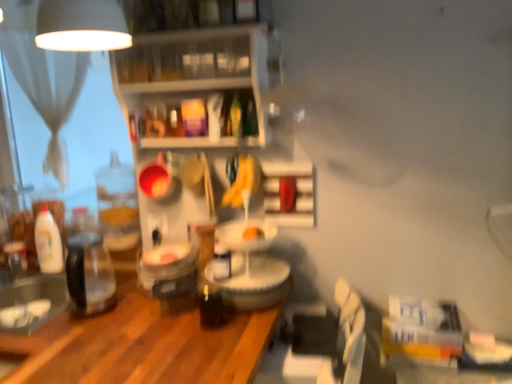
Describe the element at coordinates (48, 243) in the screenshot. Image resolution: width=512 pixels, height=384 pixels. I see `white glossy bottle at left` at that location.

Find the location of a particular element. white sheer curtain at upper left is located at coordinates (42, 78).

What is the approximate width of yellow matte bananas at center?

It is 2.88 inches.

What do you see at coordinates (289, 193) in the screenshot? The image size is (512, 384). I see `white matte shelf at center, which appears as the first shelf when ordered from the bottom` at bounding box center [289, 193].

What is the approximate height of clear plastic shelves at upper center, which ranks as the 2th shelf in right-to-left order?

The height of clear plastic shelves at upper center, which ranks as the 2th shelf in right-to-left order, is 37.31 centimeters.

The height and width of the screenshot is (384, 512). What are the coordinates of `white glossy bottle at left` in the screenshot? It's located at (48, 243).

Considering their positions, is clear glass jar at left located in front of or behind clear plastic shelves at upper center, the first shelf in the left-to-right sequence?

Visually, clear glass jar at left is located in front of clear plastic shelves at upper center, the first shelf in the left-to-right sequence.

Does clear glass jar at left have a greater width compared to clear plastic shelves at upper center, marked as the second shelf in a bottom-to-top arrangement?

Correct, the width of clear glass jar at left exceeds that of clear plastic shelves at upper center, marked as the second shelf in a bottom-to-top arrangement.

Is clear glass jar at left taller than clear plastic shelves at upper center, which ranks as the 2th shelf in right-to-left order?

No, clear glass jar at left is not taller than clear plastic shelves at upper center, which ranks as the 2th shelf in right-to-left order.

Looking at the image, does wooden table at center seem bigger or smaller compared to clear plastic shelves at upper center, marked as the second shelf in a bottom-to-top arrangement?

wooden table at center is bigger than clear plastic shelves at upper center, marked as the second shelf in a bottom-to-top arrangement.

From the image's perspective, is wooden table at center located above clear plastic shelves at upper center, the first shelf in the left-to-right sequence?

Incorrect, from the image's perspective, wooden table at center is lower than clear plastic shelves at upper center, the first shelf in the left-to-right sequence.

Which is in front, point (17, 336) or point (233, 42)?

The point (17, 336) is more forward.

Between white glossy bottle at left and clear plastic shelves at upper center, the first shelf in the left-to-right sequence, which one is positioned behind?

Positioned behind is white glossy bottle at left.

You are a GUI agent. You are given a task and a screenshot of the screen. Output one action in this format:
    pyautogui.click(x=<x>, y=<y>)
    Task: Click on the 2nd shelf in front of the white glossy bottle at left
    
    Given the screenshot: What is the action you would take?
    pyautogui.click(x=193, y=66)

From the picture: From the image's perspective, which one is positioned higher, white glossy bottle at left or clear plastic shelves at upper center, marked as the 1th shelf in a top-to-bottom arrangement?

clear plastic shelves at upper center, marked as the 1th shelf in a top-to-bottom arrangement, appears higher in the image.

From the image's perspective, which one is positioned higher, yellow matte bananas at center or wooden table at center?

yellow matte bananas at center appears higher in the image.

From a real-world perspective, is yellow matte bananas at center on top of wooden table at center?

Indeed, from a real-world perspective, yellow matte bananas at center stands above wooden table at center.

Between yellow matte bananas at center and wooden table at center, which one is positioned behind?

yellow matte bananas at center is further away from the camera.

Is yellow matte bananas at center shorter than wooden table at center?

Indeed, yellow matte bananas at center has a lesser height compared to wooden table at center.

What's the angular difference between clear plastic shelves at upper center, marked as the second shelf in a bottom-to-top arrangement, and clear glass jar at left's facing directions?

The angular difference between clear plastic shelves at upper center, marked as the second shelf in a bottom-to-top arrangement, and clear glass jar at left is 2.39 degrees.

Considering the sizes of clear plastic shelves at upper center, which ranks as the 2th shelf in right-to-left order, and clear glass jar at left in the image, is clear plastic shelves at upper center, which ranks as the 2th shelf in right-to-left order, wider or thinner than clear glass jar at left?

Clearly, clear plastic shelves at upper center, which ranks as the 2th shelf in right-to-left order, has less width compared to clear glass jar at left.

Which is behind, point (252, 81) or point (67, 247)?

Point (67, 247)

Is clear plastic shelves at upper center, which ranks as the 2th shelf in right-to-left order, smaller than clear glass jar at left?

No, clear plastic shelves at upper center, which ranks as the 2th shelf in right-to-left order, is not smaller than clear glass jar at left.

Is white sheer curtain at upper left far from clear plastic shelves at upper center, marked as the 1th shelf in a top-to-bottom arrangement?

No, there isn't a large distance between white sheer curtain at upper left and clear plastic shelves at upper center, marked as the 1th shelf in a top-to-bottom arrangement.

Locate an element on the screen. Image resolution: width=512 pixels, height=384 pixels. the 1st shelf to the right when counting from the white sheer curtain at upper left is located at coordinates (193, 66).

Considering the relative sizes of white sheer curtain at upper left and clear plastic shelves at upper center, the first shelf in the left-to-right sequence, in the image provided, is white sheer curtain at upper left shorter than clear plastic shelves at upper center, the first shelf in the left-to-right sequence,?

No.

Is white sheer curtain at upper left positioned with its back to clear plastic shelves at upper center, marked as the 1th shelf in a top-to-bottom arrangement?

That's not correct — white sheer curtain at upper left is not looking away from clear plastic shelves at upper center, marked as the 1th shelf in a top-to-bottom arrangement.

Is the position of white glossy bottle at left more distant than that of yellow matte bananas at center?

Yes, the depth of white glossy bottle at left is greater than that of yellow matte bananas at center.

Could you tell me if white glossy bottle at left is turned towards yellow matte bananas at center?

No, white glossy bottle at left does not turn towards yellow matte bananas at center.

Would you say white glossy bottle at left is a long distance from yellow matte bananas at center?

They are positioned close to each other.

Which of these two, white glossy bottle at left or yellow matte bananas at center, stands shorter?

yellow matte bananas at center.

From the image's perspective, count 2nd shelfs upward from the clear glass jar at left and point to it. Please provide its 2D coordinates.

[(193, 66)]

From a real-world perspective, count 2nd shelfs upward from the wooden table at center and point to it. Please provide its 2D coordinates.

[(193, 66)]

Which object lies nearer to the anchor point clear glass jar at left, yellow matte bananas at center or white glossy bottle at left?

white glossy bottle at left lies closer to clear glass jar at left than the other object.

Looking at the image, which one is located further to clear plastic shelves at upper center, which ranks as the 2th shelf in right-to-left order, wooden table at center or clear glass jar at left?

Based on the image, wooden table at center appears to be further to clear plastic shelves at upper center, which ranks as the 2th shelf in right-to-left order.

Looking at the image, which one is located further to clear glass jar at left, white matte shelf at center, the 2th shelf when ordered from top to bottom, or white glossy bottle at left?

white matte shelf at center, the 2th shelf when ordered from top to bottom, is positioned further to the anchor clear glass jar at left.

Looking at this image, based on their spatial positions, is wooden table at center or clear plastic shelves at upper center, marked as the 1th shelf in a top-to-bottom arrangement, further from white glossy bottle at left?

clear plastic shelves at upper center, marked as the 1th shelf in a top-to-bottom arrangement, is positioned further to the anchor white glossy bottle at left.

Which object lies nearer to the anchor point clear glass jar at left, clear plastic shelves at upper center, the first shelf in the left-to-right sequence, or wooden table at center?

wooden table at center is positioned closer to the anchor clear glass jar at left.

Looking at the image, which one is located closer to white glossy bottle at left, clear glass jar at left or clear plastic shelves at upper center, the first shelf in the left-to-right sequence?

clear glass jar at left.

Considering their positions, is white matte shelf at center, the 2th shelf from the left, positioned further to clear plastic shelves at upper center, which ranks as the 2th shelf in right-to-left order, than yellow matte bananas at center?

white matte shelf at center, the 2th shelf from the left, is further to clear plastic shelves at upper center, which ranks as the 2th shelf in right-to-left order.

Which object lies further to the anchor point white sheer curtain at upper left, wooden table at center or white matte shelf at center, the first shelf when ordered from right to left?

Based on the image, white matte shelf at center, the first shelf when ordered from right to left, appears to be further to white sheer curtain at upper left.

I want to click on bottle between clear plastic shelves at upper center, which ranks as the 2th shelf in right-to-left order, and wooden table at center, in the vertical direction, so click(48, 243).

What are the coordinates of `banana between white glossy bottle at left and white matte shelf at center, the first shelf when ordered from right to left` in the screenshot? It's located at (243, 181).

This screenshot has width=512, height=384. I want to click on shelf between clear plastic shelves at upper center, marked as the second shelf in a bottom-to-top arrangement, and wooden table at center in the up-down direction, so click(289, 193).

This screenshot has height=384, width=512. Find the location of `bottle between clear plastic shelves at upper center, which ranks as the 2th shelf in right-to-left order, and clear glass jar at left, in the vertical direction`. bottle between clear plastic shelves at upper center, which ranks as the 2th shelf in right-to-left order, and clear glass jar at left, in the vertical direction is located at coordinates (48, 243).